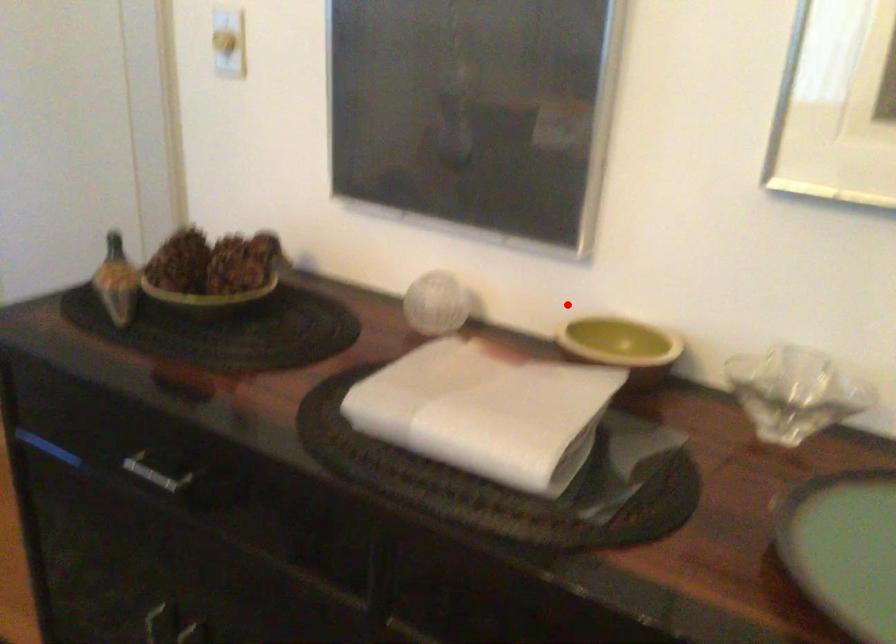
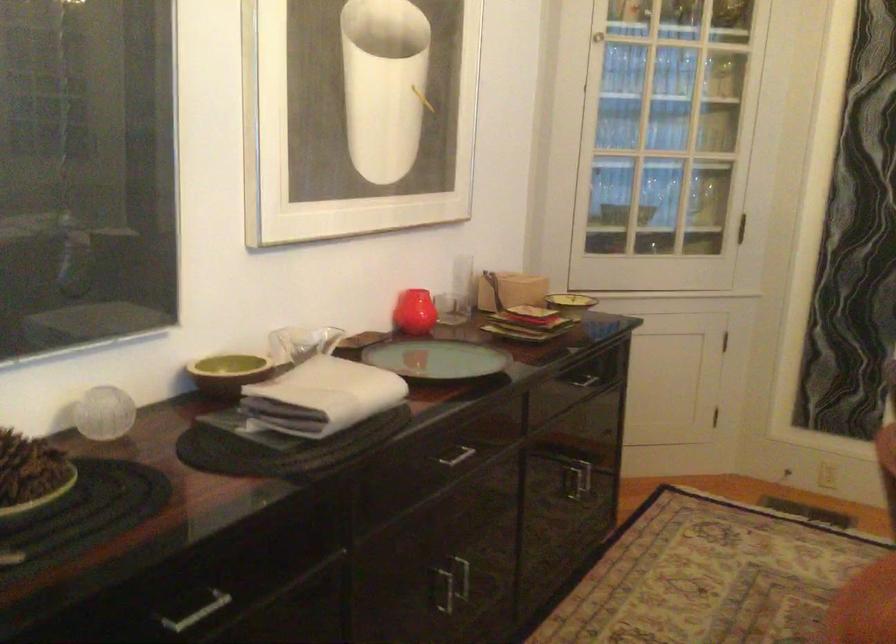
Question: A red point is marked in image1. In image2, is the corresponding 3D point closer to the camera or farther? Reply with the corresponding letter.

Choices:
 (A) The corresponding 3D point is closer.
 (B) The corresponding 3D point is farther.

Answer: (B)